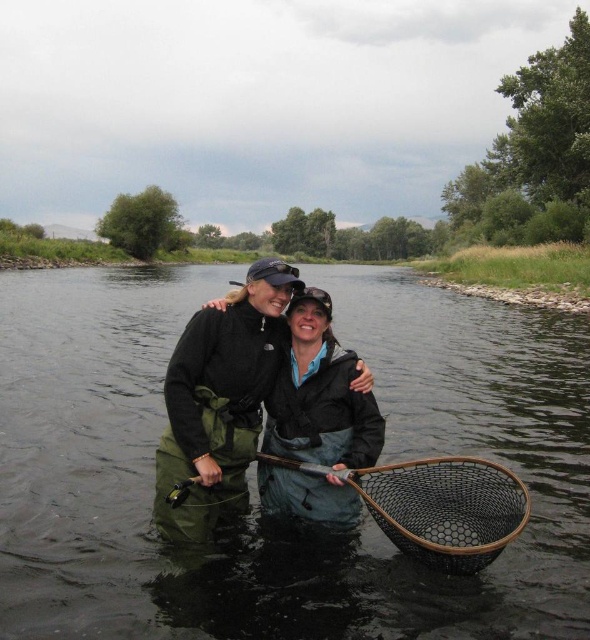
Question: Which of the following is the closest to the observer?

Choices:
 (A) clear water at center
 (B) green waterproof jacket at center
 (C) black matte jacket at center

Answer: (A)

Question: Which of the following is the closest to the observer?

Choices:
 (A) clear water at center
 (B) black matte jacket at center
 (C) green waterproof jacket at center

Answer: (A)

Question: Can you confirm if clear water at center is positioned below green waterproof jacket at center?

Choices:
 (A) yes
 (B) no

Answer: (B)

Question: Considering the relative positions of clear water at center and black matte jacket at center in the image provided, where is clear water at center located with respect to black matte jacket at center?

Choices:
 (A) left
 (B) right

Answer: (A)

Question: Is clear water at center bigger than green waterproof jacket at center?

Choices:
 (A) yes
 (B) no

Answer: (A)

Question: Which point is closer to the camera?

Choices:
 (A) black matte jacket at center
 (B) green waterproof jacket at center
 (C) clear water at center

Answer: (C)